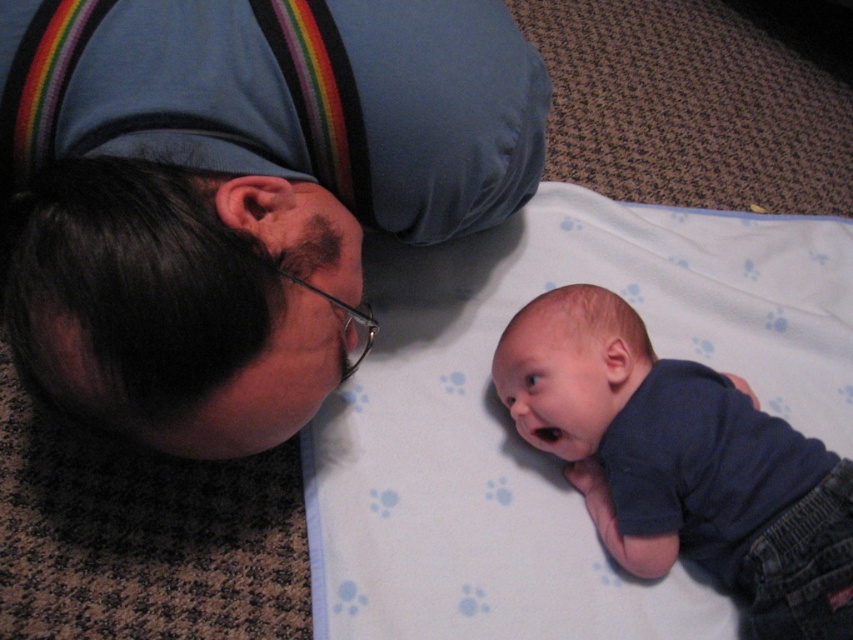
Does point (167, 404) lie behind point (830, 566)?

No, it is not.

Which is in front, point (271, 113) or point (625, 445)?

Positioned in front is point (271, 113).

You are a GUI agent. You are given a task and a screenshot of the screen. Output one action in this format:
    pyautogui.click(x=<x>, y=<y>)
    Task: Click on the matte black head at upper left
    This screenshot has width=853, height=640.
    Given the screenshot: What is the action you would take?
    pyautogui.click(x=239, y=193)